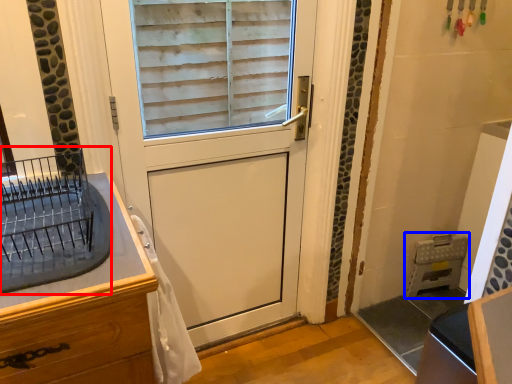
Question: Which of the following is the closest to the observer, appliance (highlighted by a red box) or appliance (highlighted by a blue box)?

Choices:
 (A) appliance
 (B) appliance

Answer: (A)